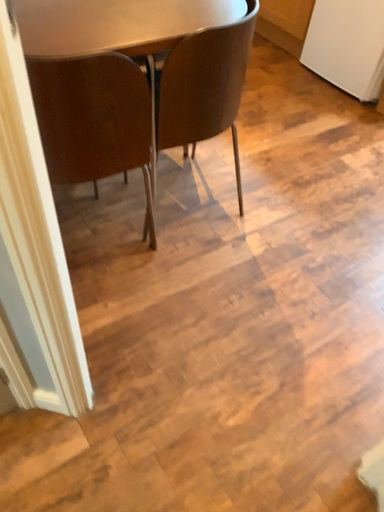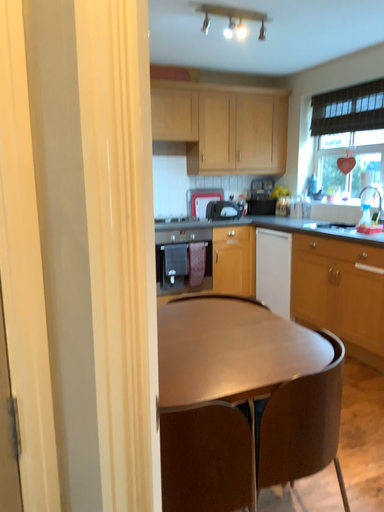
Question: How did the camera likely rotate when shooting the video?

Choices:
 (A) rotated right
 (B) rotated left

Answer: (B)